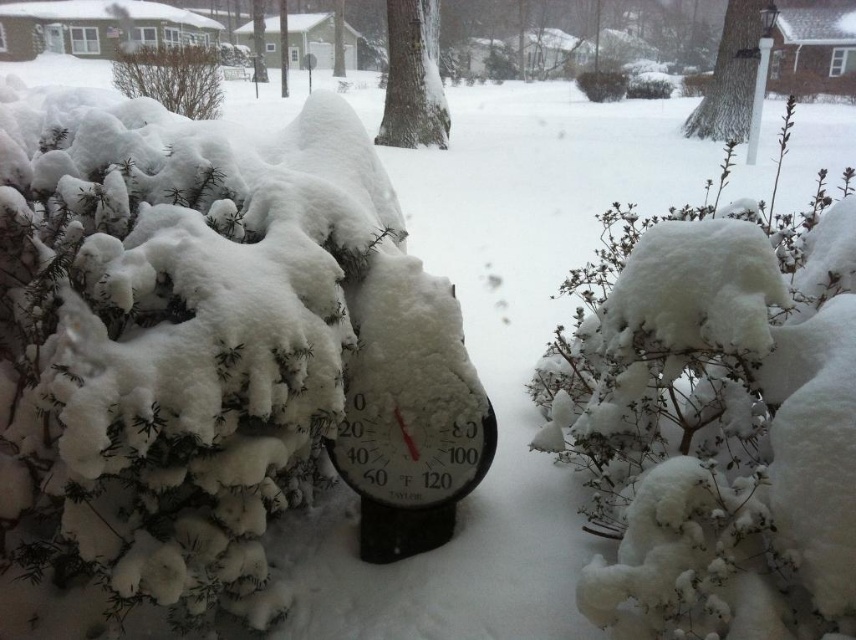
Between smooth bark tree at upper right and brown textured bush at upper left, which one is positioned higher?

smooth bark tree at upper right

Describe the element at coordinates (730, 76) in the screenshot. I see `smooth bark tree at upper right` at that location.

Between point (733, 48) and point (153, 60), which one is positioned in front?

Positioned in front is point (153, 60).

Where is `smooth bark tree at upper right`? Image resolution: width=856 pixels, height=640 pixels. smooth bark tree at upper right is located at coordinates (730, 76).

Does smooth bark tree at center appear under smooth bark tree at upper right?

Yes.

Is point (388, 67) more distant than point (726, 29)?

Yes, it is behind point (726, 29).

I want to click on smooth bark tree at center, so click(413, 77).

This screenshot has height=640, width=856. What do you see at coordinates (413, 77) in the screenshot?
I see `smooth bark tree at center` at bounding box center [413, 77].

Where is `smooth bark tree at center`? This screenshot has height=640, width=856. smooth bark tree at center is located at coordinates 413,77.